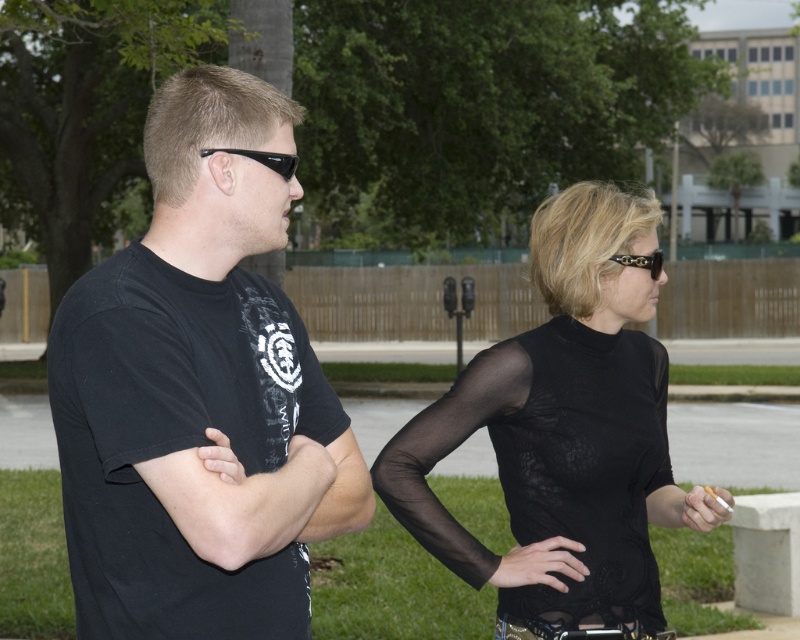
Question: Which object is positioned farthest from the matte black cigarette at lower right?

Choices:
 (A) black mesh glove at lower center
 (B) black matte sunglasses at left
 (C) black matte t-shirt at left

Answer: (B)

Question: Does sheer black dress at center have a smaller size compared to black matte sunglasses at left?

Choices:
 (A) no
 (B) yes

Answer: (A)

Question: Is black matte t-shirt at left behind sheer black dress at center?

Choices:
 (A) yes
 (B) no

Answer: (B)

Question: Based on their relative distances, which object is nearer to the black matte t-shirt at left?

Choices:
 (A) matte black cigarette at lower right
 (B) black matte sunglasses at left
 (C) black mesh glove at lower center

Answer: (B)

Question: Is the position of sheer black top at center more distant than that of matte black cigarette at lower right?

Choices:
 (A) no
 (B) yes

Answer: (A)

Question: Which point is closer to the camera?

Choices:
 (A) black matte sunglasses at left
 (B) matte black cigarette at lower right
 (C) sheer black dress at center
 (D) black matte t-shirt at left

Answer: (D)